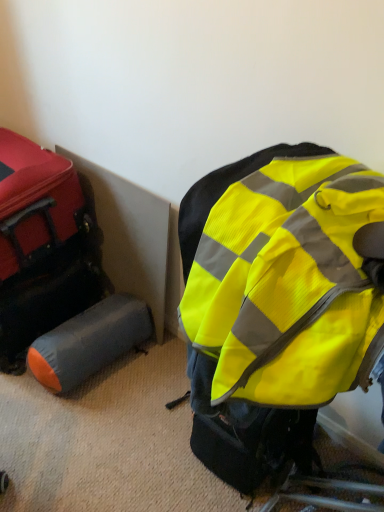
The width and height of the screenshot is (384, 512). What do you see at coordinates (283, 279) in the screenshot?
I see `high-visibility fabric backpack at center` at bounding box center [283, 279].

This screenshot has width=384, height=512. What do you see at coordinates (34, 202) in the screenshot?
I see `matte red suitcase at left, marked as the first luggage in a top-to-bottom arrangement` at bounding box center [34, 202].

This screenshot has height=512, width=384. I want to click on matte red suitcase at left, marked as the first luggage in a top-to-bottom arrangement, so click(x=34, y=202).

Find the location of `gray fabric cylinder at lower left, which is counted as the 1th luggage, starting from the bottom`. gray fabric cylinder at lower left, which is counted as the 1th luggage, starting from the bottom is located at coordinates (89, 342).

This screenshot has height=512, width=384. What are the coordinates of `orange-gray fabric sleeping bag at lower left` in the screenshot? It's located at (42, 247).

What do you see at coordinates (42, 247) in the screenshot? This screenshot has width=384, height=512. I see `orange-gray fabric sleeping bag at lower left` at bounding box center [42, 247].

Find the location of a particular element. This screenshot has width=384, height=512. high-visibility fabric backpack at center is located at coordinates (283, 279).

Find the location of a particular element. This screenshot has height=512, width=384. luggage above the gray fabric cylinder at lower left, the second luggage from the top (from a real-world perspective) is located at coordinates (34, 202).

Is gray fabric cylinder at lower left, the second luggage from the top, positioned beyond the bounds of matte red suitcase at left, placed as the second luggage when sorted from bottom to top?

Absolutely, gray fabric cylinder at lower left, the second luggage from the top, is external to matte red suitcase at left, placed as the second luggage when sorted from bottom to top.

Is gray fabric cylinder at lower left, the second luggage from the top, far away from matte red suitcase at left, marked as the first luggage in a top-to-bottom arrangement?

That's not correct — gray fabric cylinder at lower left, the second luggage from the top, is a little close to matte red suitcase at left, marked as the first luggage in a top-to-bottom arrangement.

Between orange-gray fabric sleeping bag at lower left and gray fabric cylinder at lower left, which is counted as the 1th luggage, starting from the bottom, which one has smaller width?

gray fabric cylinder at lower left, which is counted as the 1th luggage, starting from the bottom.

Looking at this image, is orange-gray fabric sleeping bag at lower left to the left or to the right of gray fabric cylinder at lower left, which is counted as the 1th luggage, starting from the bottom, in the image?

orange-gray fabric sleeping bag at lower left is to the left of gray fabric cylinder at lower left, which is counted as the 1th luggage, starting from the bottom.

From the image's perspective, which one is positioned lower, orange-gray fabric sleeping bag at lower left or gray fabric cylinder at lower left, which is counted as the 1th luggage, starting from the bottom?

From the image's view, gray fabric cylinder at lower left, which is counted as the 1th luggage, starting from the bottom, is below.

From a real-world perspective, is orange-gray fabric sleeping bag at lower left positioned under gray fabric cylinder at lower left, the second luggage from the top, based on gravity?

Actually, orange-gray fabric sleeping bag at lower left is physically above gray fabric cylinder at lower left, the second luggage from the top, in the real world.

How far apart are gray fabric cylinder at lower left, which is counted as the 1th luggage, starting from the bottom, and high-visibility fabric backpack at center?

gray fabric cylinder at lower left, which is counted as the 1th luggage, starting from the bottom, is 32.49 inches away from high-visibility fabric backpack at center.

Is point (58, 343) positioned behind point (245, 361)?

Yes, it is behind point (245, 361).

Considering the relative positions of gray fabric cylinder at lower left, the second luggage from the top, and high-visibility fabric backpack at center in the image provided, is gray fabric cylinder at lower left, the second luggage from the top, behind high-visibility fabric backpack at center?

Yes, it is behind high-visibility fabric backpack at center.

How different are the orientations of gray fabric cylinder at lower left, the second luggage from the top, and high-visibility fabric backpack at center in degrees?

1.65 degrees.

Where is `backpack below the orange-gray fabric sleeping bag at lower left (from the image's perspective)`? backpack below the orange-gray fabric sleeping bag at lower left (from the image's perspective) is located at coordinates (283, 279).

From a real-world perspective, relative to orange-gray fabric sleeping bag at lower left, is high-visibility fabric backpack at center vertically above or below?

high-visibility fabric backpack at center is situated higher than orange-gray fabric sleeping bag at lower left in the real world.

Is high-visibility fabric backpack at center oriented away from orange-gray fabric sleeping bag at lower left?

high-visibility fabric backpack at center is not turned away from orange-gray fabric sleeping bag at lower left.

Is the surface of high-visibility fabric backpack at center in direct contact with orange-gray fabric sleeping bag at lower left?

No, high-visibility fabric backpack at center is not touching orange-gray fabric sleeping bag at lower left.

Which object is positioned more to the left, matte red suitcase at left, marked as the first luggage in a top-to-bottom arrangement, or gray fabric cylinder at lower left, the second luggage from the top?

Positioned to the left is matte red suitcase at left, marked as the first luggage in a top-to-bottom arrangement.

Can you confirm if matte red suitcase at left, placed as the second luggage when sorted from bottom to top, is smaller than gray fabric cylinder at lower left, the second luggage from the top?

No, matte red suitcase at left, placed as the second luggage when sorted from bottom to top, is not smaller than gray fabric cylinder at lower left, the second luggage from the top.

Considering the sizes of objects matte red suitcase at left, marked as the first luggage in a top-to-bottom arrangement, and gray fabric cylinder at lower left, which is counted as the 1th luggage, starting from the bottom, in the image provided, who is taller, matte red suitcase at left, marked as the first luggage in a top-to-bottom arrangement, or gray fabric cylinder at lower left, which is counted as the 1th luggage, starting from the bottom,?

matte red suitcase at left, marked as the first luggage in a top-to-bottom arrangement.

From the image's perspective, which one is positioned lower, high-visibility fabric backpack at center or matte red suitcase at left, placed as the second luggage when sorted from bottom to top?

high-visibility fabric backpack at center, from the image's perspective.

What's the angular difference between high-visibility fabric backpack at center and matte red suitcase at left, marked as the first luggage in a top-to-bottom arrangement,'s facing directions?

The angle between the facing direction of high-visibility fabric backpack at center and the facing direction of matte red suitcase at left, marked as the first luggage in a top-to-bottom arrangement, is 0.00287 degrees.

From a real-world perspective, does high-visibility fabric backpack at center sit lower than matte red suitcase at left, placed as the second luggage when sorted from bottom to top?

Yes, from a real-world perspective, high-visibility fabric backpack at center is beneath matte red suitcase at left, placed as the second luggage when sorted from bottom to top.

Choose the correct answer: Is high-visibility fabric backpack at center inside matte red suitcase at left, placed as the second luggage when sorted from bottom to top, or outside it?

high-visibility fabric backpack at center is located beyond the bounds of matte red suitcase at left, placed as the second luggage when sorted from bottom to top.

Is orange-gray fabric sleeping bag at lower left looking in the opposite direction of matte red suitcase at left, placed as the second luggage when sorted from bottom to top?

orange-gray fabric sleeping bag at lower left does not have its back to matte red suitcase at left, placed as the second luggage when sorted from bottom to top.

I want to click on luggage and bags that is behind the matte red suitcase at left, placed as the second luggage when sorted from bottom to top, so click(x=42, y=247).

Is orange-gray fabric sleeping bag at lower left at the right side of matte red suitcase at left, marked as the first luggage in a top-to-bottom arrangement?

Yes.

Considering the sizes of orange-gray fabric sleeping bag at lower left and matte red suitcase at left, placed as the second luggage when sorted from bottom to top, in the image, is orange-gray fabric sleeping bag at lower left taller or shorter than matte red suitcase at left, placed as the second luggage when sorted from bottom to top,?

orange-gray fabric sleeping bag at lower left is shorter than matte red suitcase at left, placed as the second luggage when sorted from bottom to top.

At what (x,y) coordinates should I click in order to perform the action: click on luggage located behind the matte red suitcase at left, marked as the first luggage in a top-to-bottom arrangement. Please return your answer as a coordinate pair (x, y). Image resolution: width=384 pixels, height=512 pixels. Looking at the image, I should click on (89, 342).

In the image, there is a orange-gray fabric sleeping bag at lower left. Where is `luggage below it (from a real-world perspective)`? Image resolution: width=384 pixels, height=512 pixels. luggage below it (from a real-world perspective) is located at coordinates (89, 342).

Based on their spatial positions, is orange-gray fabric sleeping bag at lower left or high-visibility fabric backpack at center closer to matte red suitcase at left, placed as the second luggage when sorted from bottom to top?

The object closer to matte red suitcase at left, placed as the second luggage when sorted from bottom to top, is orange-gray fabric sleeping bag at lower left.

Estimate the real-world distances between objects in this image. Which object is further from matte red suitcase at left, placed as the second luggage when sorted from bottom to top, orange-gray fabric sleeping bag at lower left or gray fabric cylinder at lower left, which is counted as the 1th luggage, starting from the bottom?

The object further to matte red suitcase at left, placed as the second luggage when sorted from bottom to top, is gray fabric cylinder at lower left, which is counted as the 1th luggage, starting from the bottom.

Based on their spatial positions, is high-visibility fabric backpack at center or orange-gray fabric sleeping bag at lower left closer to matte red suitcase at left, placed as the second luggage when sorted from bottom to top?

The object closer to matte red suitcase at left, placed as the second luggage when sorted from bottom to top, is orange-gray fabric sleeping bag at lower left.

Consider the image. Estimate the real-world distances between objects in this image. Which object is closer to gray fabric cylinder at lower left, which is counted as the 1th luggage, starting from the bottom, high-visibility fabric backpack at center or matte red suitcase at left, placed as the second luggage when sorted from bottom to top?

The object closer to gray fabric cylinder at lower left, which is counted as the 1th luggage, starting from the bottom, is matte red suitcase at left, placed as the second luggage when sorted from bottom to top.

From the image, which object appears to be farther from high-visibility fabric backpack at center, gray fabric cylinder at lower left, which is counted as the 1th luggage, starting from the bottom, or orange-gray fabric sleeping bag at lower left?

orange-gray fabric sleeping bag at lower left is positioned further to the anchor high-visibility fabric backpack at center.

Estimate the real-world distances between objects in this image. Which object is closer to high-visibility fabric backpack at center, matte red suitcase at left, marked as the first luggage in a top-to-bottom arrangement, or gray fabric cylinder at lower left, the second luggage from the top?

Among the two, gray fabric cylinder at lower left, the second luggage from the top, is located nearer to high-visibility fabric backpack at center.

When comparing their distances from gray fabric cylinder at lower left, the second luggage from the top, does matte red suitcase at left, marked as the first luggage in a top-to-bottom arrangement, or orange-gray fabric sleeping bag at lower left seem further?

matte red suitcase at left, marked as the first luggage in a top-to-bottom arrangement, lies further to gray fabric cylinder at lower left, the second luggage from the top, than the other object.

Which object lies further to the anchor point orange-gray fabric sleeping bag at lower left, gray fabric cylinder at lower left, the second luggage from the top, or high-visibility fabric backpack at center?

high-visibility fabric backpack at center is positioned further to the anchor orange-gray fabric sleeping bag at lower left.

Find the location of a particular element. This screenshot has width=384, height=512. luggage situated between matte red suitcase at left, placed as the second luggage when sorted from bottom to top, and high-visibility fabric backpack at center from left to right is located at coordinates (89, 342).

The width and height of the screenshot is (384, 512). In order to click on luggage and bags between matte red suitcase at left, placed as the second luggage when sorted from bottom to top, and high-visibility fabric backpack at center from left to right in this screenshot , I will do click(42, 247).

The image size is (384, 512). In order to click on luggage and bags between matte red suitcase at left, marked as the first luggage in a top-to-bottom arrangement, and gray fabric cylinder at lower left, which is counted as the 1th luggage, starting from the bottom, in the up-down direction in this screenshot , I will do `click(42, 247)`.